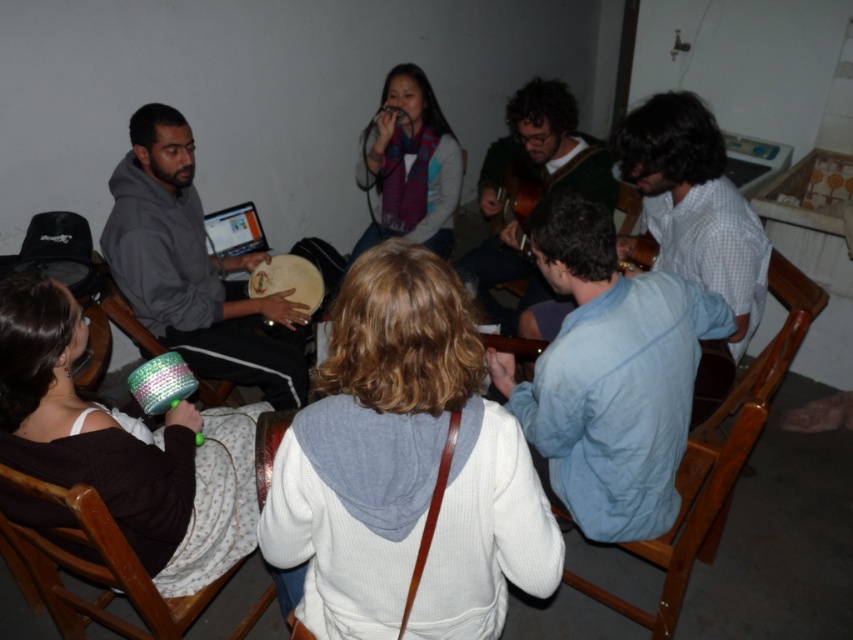
Question: Is smooth wooden drum at center to the left of metallic sequined tambourine at lower left from the viewer's perspective?

Choices:
 (A) no
 (B) yes

Answer: (A)

Question: Which point is farther from the camera taking this photo?

Choices:
 (A) (392, 74)
 (B) (173, 188)
 (C) (134, 328)
 (D) (788, 294)

Answer: (A)

Question: Considering the relative positions of gray hoodie at left and wooden chair at lower left in the image provided, where is gray hoodie at left located with respect to wooden chair at lower left?

Choices:
 (A) right
 (B) left

Answer: (A)

Question: Which point appears closest to the camera in this image?

Choices:
 (A) (209, 403)
 (B) (692, 294)
 (C) (543, 339)
 (D) (434, 573)

Answer: (D)

Question: Is wooden chair at lower left above dark brown hair at center?

Choices:
 (A) no
 (B) yes

Answer: (A)

Question: Which point is farther to the camera?

Choices:
 (A) (523, 188)
 (B) (515, 355)

Answer: (A)